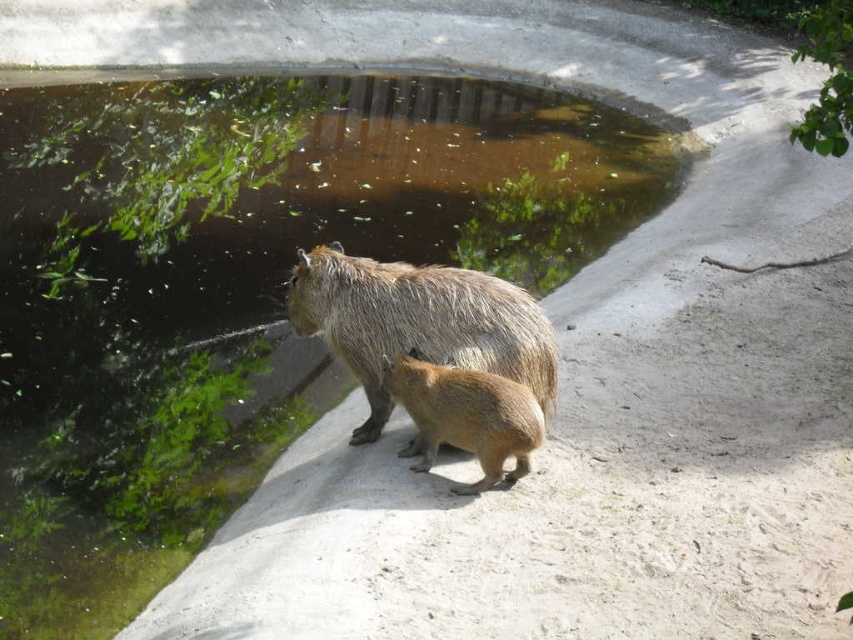
Is point (276, 410) closer to camera compared to point (349, 355)?

No, (276, 410) is behind (349, 355).

Can you confirm if green mossy water at center is taller than fuzzy brown capybara at center?

In fact, green mossy water at center may be shorter than fuzzy brown capybara at center.

The height and width of the screenshot is (640, 853). I want to click on green mossy water at center, so point(241,285).

Locate an element on the screen. green mossy water at center is located at coordinates (x=241, y=285).

Does fuzzy brown capybara at center appear over brown furry capybara at center?

Yes.

Which of these two, fuzzy brown capybara at center or brown furry capybara at center, stands shorter?

With less height is brown furry capybara at center.

The width and height of the screenshot is (853, 640). What do you see at coordinates (418, 323) in the screenshot?
I see `fuzzy brown capybara at center` at bounding box center [418, 323].

You are a GUI agent. You are given a task and a screenshot of the screen. Output one action in this format:
    pyautogui.click(x=<x>, y=<y>)
    Task: Click on the fuzzy brown capybara at center
    This screenshot has height=640, width=853.
    Given the screenshot: What is the action you would take?
    pyautogui.click(x=418, y=323)

Measure the distance from green mossy water at center to brown furry capybara at center.

green mossy water at center is 6.32 feet from brown furry capybara at center.

The image size is (853, 640). Describe the element at coordinates (241, 285) in the screenshot. I see `green mossy water at center` at that location.

Where is `green mossy water at center`? Image resolution: width=853 pixels, height=640 pixels. green mossy water at center is located at coordinates (241, 285).